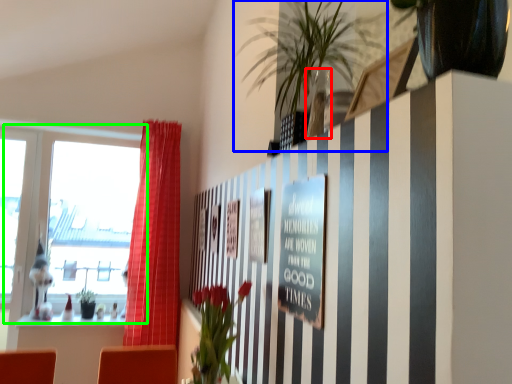
Question: Based on their relative distances, which object is farther from vase (highlighted by a red box)? Choose from houseplant (highlighted by a blue box) and window (highlighted by a green box).

Choices:
 (A) houseplant
 (B) window

Answer: (B)